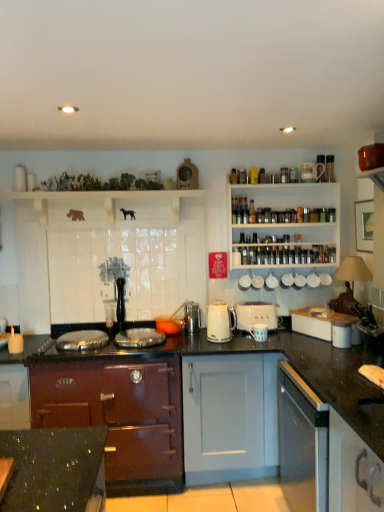
You are a GUI agent. You are given a task and a screenshot of the screen. Output one action in this format:
    pyautogui.click(x=<x>, y=<y>)
    Task: Click on the vacant region under white glossy electric kettle at center (from a real-world perspective)
    This screenshot has width=384, height=512.
    Given the screenshot: What is the action you would take?
    pyautogui.click(x=233, y=340)